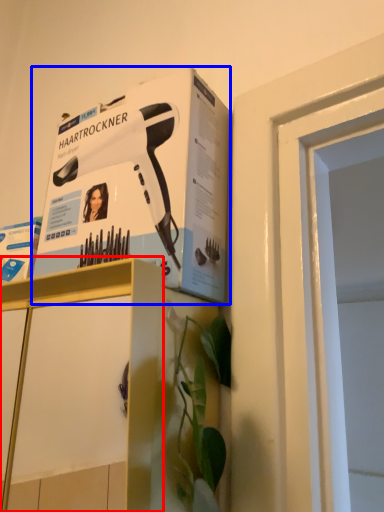
Question: Which object appears closest to the camera in this image, cabinetry (highlighted by a red box) or paperback book (highlighted by a blue box)?

Choices:
 (A) cabinetry
 (B) paperback book

Answer: (A)